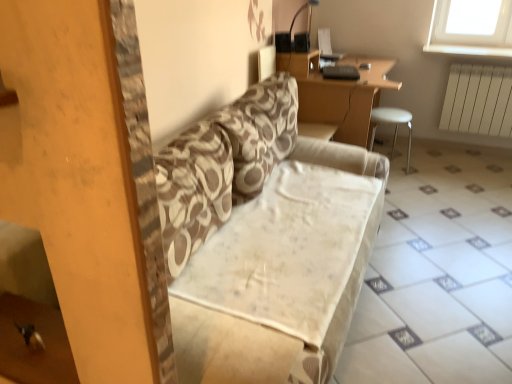
Question: From the image's perspective, would you say wooden desk at upper center is positioned over patterned fabric couch at center?

Choices:
 (A) yes
 (B) no

Answer: (A)

Question: Is wooden desk at upper center shorter than patterned fabric couch at center?

Choices:
 (A) yes
 (B) no

Answer: (B)

Question: Is wooden desk at upper center positioned far away from patterned fabric couch at center?

Choices:
 (A) no
 (B) yes

Answer: (B)

Question: Considering the relative sizes of wooden desk at upper center and patterned fabric couch at center in the image provided, is wooden desk at upper center bigger than patterned fabric couch at center?

Choices:
 (A) yes
 (B) no

Answer: (B)

Question: Considering the relative positions of wooden desk at upper center and patterned fabric couch at center in the image provided, is wooden desk at upper center behind patterned fabric couch at center?

Choices:
 (A) no
 (B) yes

Answer: (B)

Question: Looking at the image, does beige fabric ottoman at center seem bigger or smaller compared to white plastic stool at right?

Choices:
 (A) small
 (B) big

Answer: (B)

Question: Would you say beige fabric ottoman at center is to the left or to the right of white plastic stool at right in the picture?

Choices:
 (A) right
 (B) left

Answer: (A)

Question: Do you think beige fabric ottoman at center is within white plastic stool at right, or outside of it?

Choices:
 (A) inside
 (B) outside

Answer: (B)

Question: Looking at their shapes, would you say beige fabric ottoman at center is wider or thinner than white plastic stool at right?

Choices:
 (A) wide
 (B) thin

Answer: (A)

Question: From the image's perspective, relative to white plastic stool at right, is wooden desk at upper center above or below?

Choices:
 (A) above
 (B) below

Answer: (A)

Question: From a real-world perspective, is wooden desk at upper center physically located above or below white plastic stool at right?

Choices:
 (A) below
 (B) above

Answer: (B)

Question: From their relative heights in the image, would you say wooden desk at upper center is taller or shorter than white plastic stool at right?

Choices:
 (A) short
 (B) tall

Answer: (B)

Question: Is wooden desk at upper center inside or outside of white plastic stool at right?

Choices:
 (A) outside
 (B) inside

Answer: (A)

Question: Does point (470, 96) appear closer or farther from the camera than point (221, 223)?

Choices:
 (A) farther
 (B) closer

Answer: (A)

Question: In terms of width, does white plastic radiator at right look wider or thinner when compared to patterned fabric couch at center?

Choices:
 (A) wide
 (B) thin

Answer: (B)